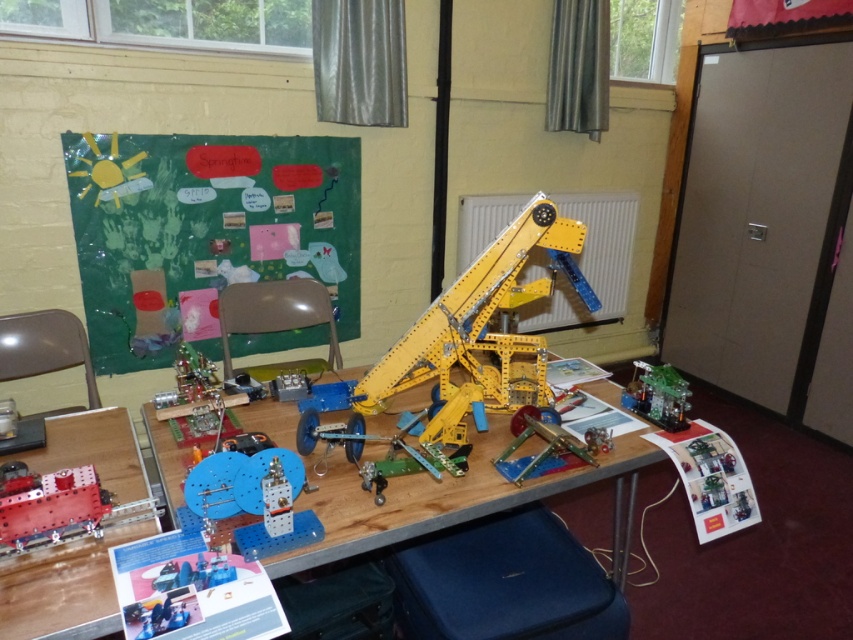
Question: Does yellow plastic table at center have a larger size compared to green plastic toy at lower right?

Choices:
 (A) yes
 (B) no

Answer: (A)

Question: Which point is farther to the camera?

Choices:
 (A) (538, 435)
 (B) (38, 516)
 (C) (497, 372)

Answer: (C)

Question: Can you confirm if yellow plastic mechanical arm at center is thinner than green plastic toy at lower right?

Choices:
 (A) yes
 (B) no

Answer: (B)

Question: Which point appears farthest from the camera in this image?

Choices:
 (A) (503, 452)
 (B) (82, 465)
 (C) (494, 484)

Answer: (A)

Question: Which object appears farthest from the camera in this image?

Choices:
 (A) yellow plastic mechanical arm at center
 (B) green paperboard at upper left
 (C) green plastic toy at lower right
 (D) metallic yellow crane at center

Answer: (B)

Question: From the image, what is the correct spatial relationship of metallic red cannon at lower left in relation to green plastic toy at lower right?

Choices:
 (A) left
 (B) right

Answer: (A)